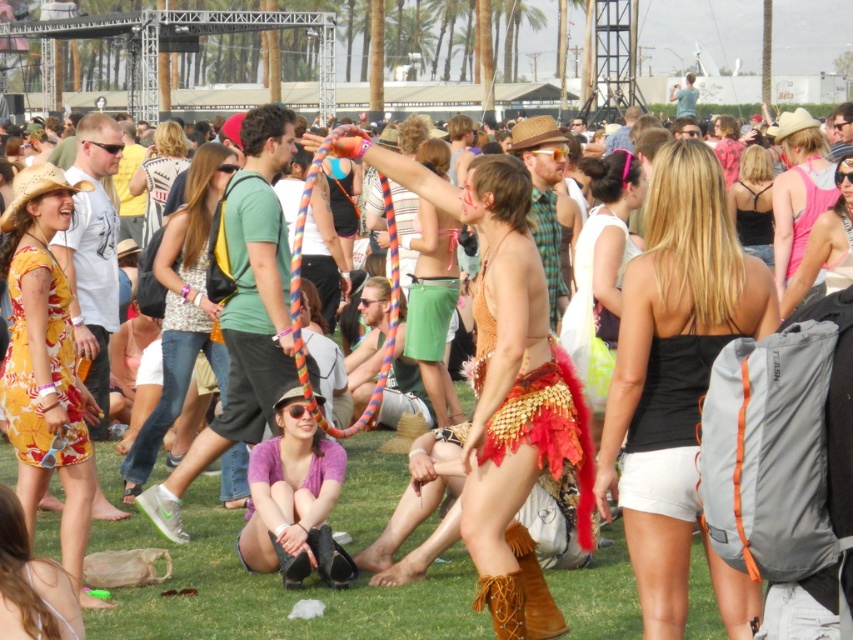
You are a photographer at the music festival. You want to capture a photo of the black matte tank top at center and the pink tank top at upper right. Which tank top has a greater width?

The black matte tank top at center has a greater width than the pink tank top at upper right.

You are a photographer at the music festival. You want to capture both the black matte tank top at center and the pink tank top at upper right in a single frame. Based on their heights, which tank top should be positioned lower in the photo to ensure both are fully visible?

The black matte tank top at center is taller than the pink tank top at upper right. To ensure both are fully visible in the photo, position the taller black matte tank top at center lower in the frame so that its full height is captured without cropping.